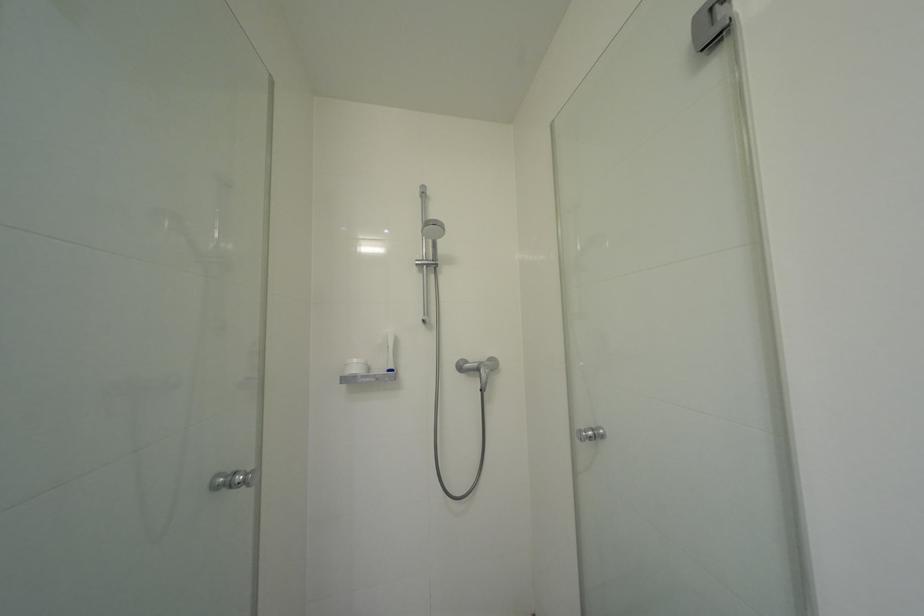
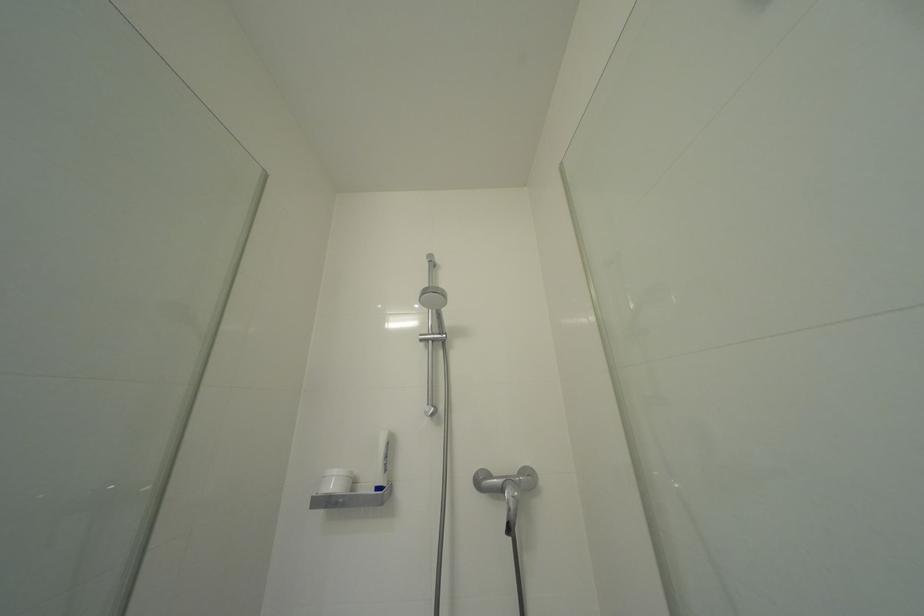
From the picture: What movement of the cameraman would produce the second image?

The movement direction of the cameraman is right, forward.